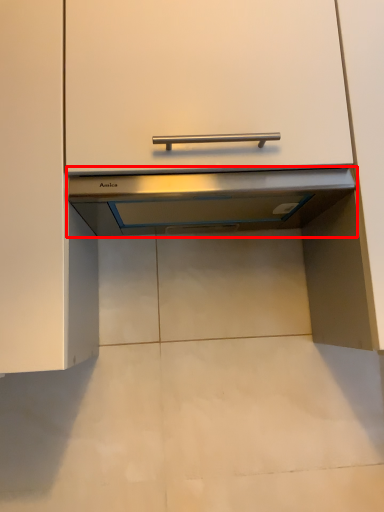
Question: From the image's perspective, where is exhaust hood (annotated by the red box) located relative to cabinetry?

Choices:
 (A) above
 (B) below

Answer: (B)